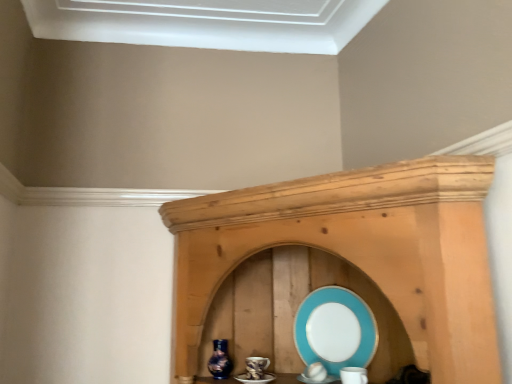
Question: In terms of height, does turquoise glossy platter at center look taller or shorter compared to shiny blue glass vase at center?

Choices:
 (A) short
 (B) tall

Answer: (B)

Question: Is turquoise glossy platter at center in front of or behind shiny blue glass vase at center in the image?

Choices:
 (A) front
 (B) behind

Answer: (A)

Question: Is turquoise glossy platter at center bigger or smaller than shiny blue glass vase at center?

Choices:
 (A) small
 (B) big

Answer: (B)

Question: Considering the relative positions of shiny blue glass vase at center and turquoise glossy platter at center in the image provided, is shiny blue glass vase at center to the left or to the right of turquoise glossy platter at center?

Choices:
 (A) left
 (B) right

Answer: (A)

Question: Looking at their shapes, would you say shiny blue glass vase at center is wider or thinner than turquoise glossy platter at center?

Choices:
 (A) thin
 (B) wide

Answer: (B)

Question: From the image's perspective, is shiny blue glass vase at center positioned above or below turquoise glossy platter at center?

Choices:
 (A) below
 (B) above

Answer: (A)

Question: Looking at the image, does shiny blue glass vase at center seem bigger or smaller compared to turquoise glossy platter at center?

Choices:
 (A) big
 (B) small

Answer: (B)